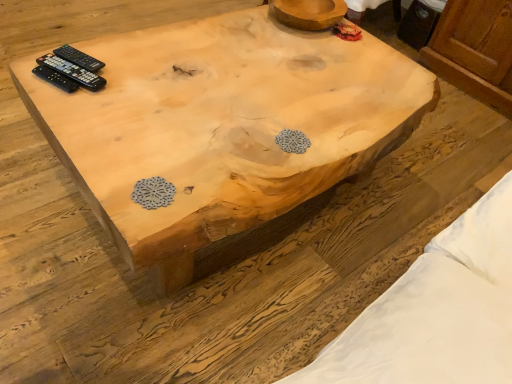
Locate an element on the screen. The height and width of the screenshot is (384, 512). free space above natural wood coffee table at center (from a real-world perspective) is located at coordinates (250, 92).